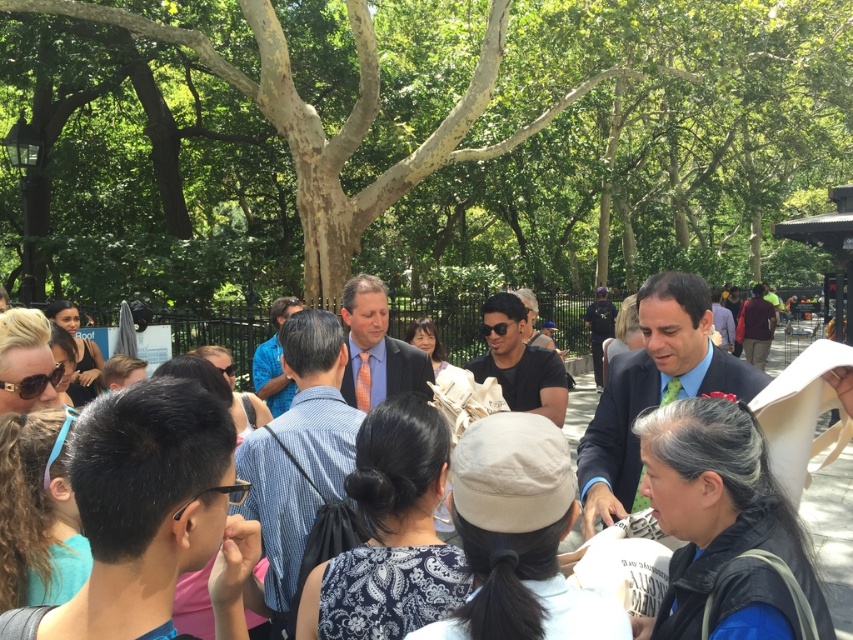
Question: Does blue striped shirt at center have a lesser width compared to matte blue suit at center?

Choices:
 (A) yes
 (B) no

Answer: (B)

Question: Among these points, which one is farthest from the camera?

Choices:
 (A) (653, 234)
 (B) (808, 513)
 (C) (277, 388)

Answer: (A)

Question: Does matte blue suit at center lie in front of matte black shirt at center?

Choices:
 (A) no
 (B) yes

Answer: (B)

Question: Considering the relative positions of matte black shirt at center and blue shirt at center in the image provided, where is matte black shirt at center located with respect to blue shirt at center?

Choices:
 (A) above
 (B) below

Answer: (B)

Question: Which object is closer to the camera taking this photo?

Choices:
 (A) orange tie at center
 (B) black matte glasses at center
 (C) blue striped shirt at center

Answer: (B)

Question: Which point is farther to the camera?

Choices:
 (A) (318, 227)
 (B) (364, 388)
 (C) (155, 570)

Answer: (A)